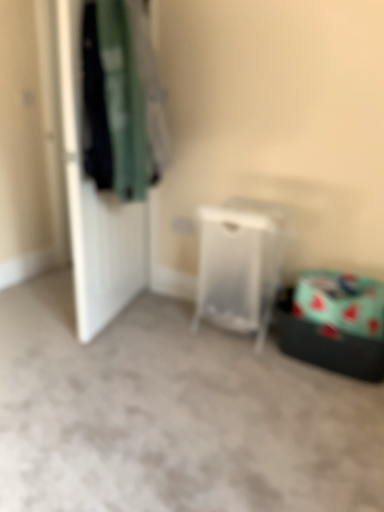
Question: Can you confirm if white matte door at left is bigger than transparent plastic laundry basket at center?

Choices:
 (A) yes
 (B) no

Answer: (B)

Question: Is white matte door at left further to camera compared to transparent plastic laundry basket at center?

Choices:
 (A) yes
 (B) no

Answer: (B)

Question: Is white matte door at left shorter than transparent plastic laundry basket at center?

Choices:
 (A) yes
 (B) no

Answer: (B)

Question: From a real-world perspective, is white matte door at left positioned under transparent plastic laundry basket at center based on gravity?

Choices:
 (A) yes
 (B) no

Answer: (B)

Question: Considering the relative sizes of white matte door at left and transparent plastic laundry basket at center in the image provided, is white matte door at left taller than transparent plastic laundry basket at center?

Choices:
 (A) no
 (B) yes

Answer: (B)

Question: Is dark green fabric at left wider or thinner than white matte door at left?

Choices:
 (A) wide
 (B) thin

Answer: (A)

Question: Is dark green fabric at left in front of or behind white matte door at left in the image?

Choices:
 (A) behind
 (B) front

Answer: (B)

Question: From their relative heights in the image, would you say dark green fabric at left is taller or shorter than white matte door at left?

Choices:
 (A) short
 (B) tall

Answer: (A)

Question: From a real-world perspective, is dark green fabric at left physically located above or below white matte door at left?

Choices:
 (A) below
 (B) above

Answer: (B)

Question: Considering the positions of white matte door at left and dark green fabric at left in the image, is white matte door at left wider or thinner than dark green fabric at left?

Choices:
 (A) thin
 (B) wide

Answer: (A)

Question: From a real-world perspective, relative to dark green fabric at left, is white matte door at left vertically above or below?

Choices:
 (A) above
 (B) below

Answer: (B)

Question: From the image's perspective, is white matte door at left located above or below dark green fabric at left?

Choices:
 (A) above
 (B) below

Answer: (B)

Question: Visually, is white matte door at left positioned to the left or to the right of dark green fabric at left?

Choices:
 (A) right
 (B) left

Answer: (B)

Question: From the image's perspective, is transparent plastic laundry basket at center positioned above or below dark green fabric at left?

Choices:
 (A) below
 (B) above

Answer: (A)

Question: From a real-world perspective, is transparent plastic laundry basket at center physically located above or below dark green fabric at left?

Choices:
 (A) above
 (B) below

Answer: (B)